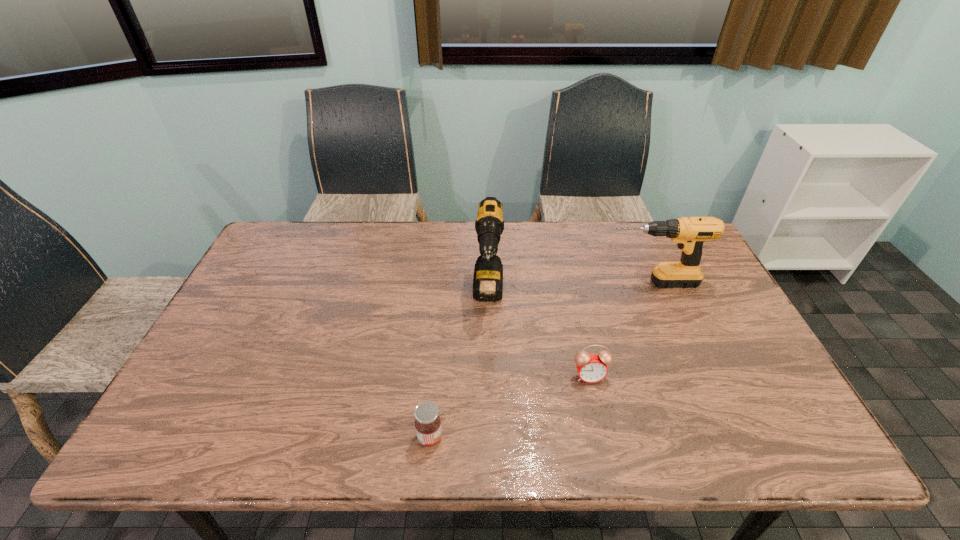
Identify the location of free location located 0.280m at the tip of the rightmost object. (509, 283).

Find the location of a particular element. This screenshot has height=540, width=960. vacant space located on the clock face of the second object from right to left is located at coordinates (604, 442).

Image resolution: width=960 pixels, height=540 pixels. I want to click on free space located on the label side of the leftmost object, so click(542, 437).

This screenshot has width=960, height=540. I want to click on object present at the near edge, so click(x=427, y=423).

Where is `object that is at the right edge`? The height and width of the screenshot is (540, 960). object that is at the right edge is located at coordinates (690, 233).

In the image, there is a desktop. What are the coordinates of `vacant space at the far edge` in the screenshot? It's located at click(x=630, y=241).

In the image, there is a desktop. In order to click on vacant space at the near edge in this screenshot , I will do `click(343, 448)`.

Identify the location of vacant space at the left edge of the desktop. The width and height of the screenshot is (960, 540). (258, 342).

The width and height of the screenshot is (960, 540). Find the location of `free space at the right edge`. free space at the right edge is located at coordinates (747, 356).

Find the location of a particular element. This screenshot has height=540, width=960. vacant space at the near left corner is located at coordinates (155, 445).